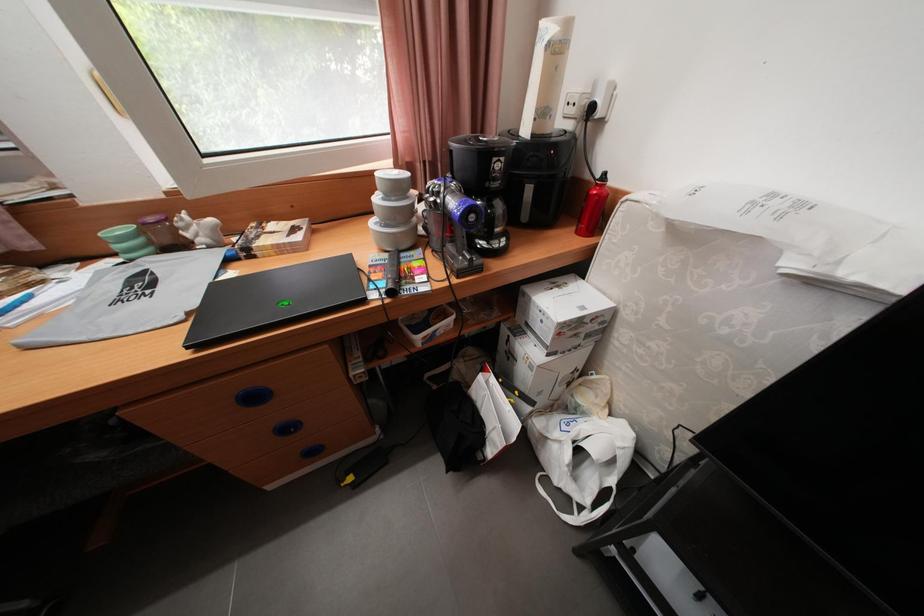
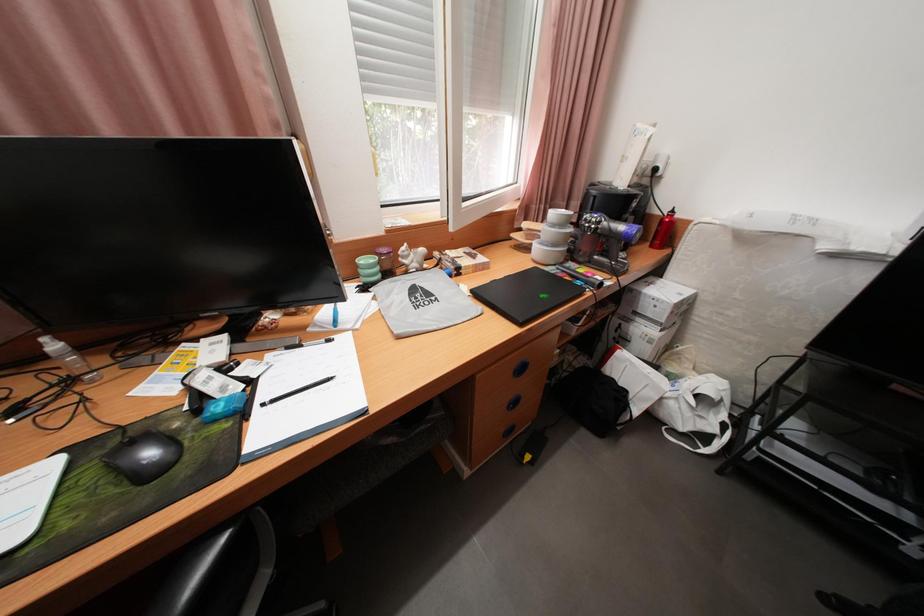
Question: How did the camera likely rotate?

Choices:
 (A) Left
 (B) Right
 (C) Up
 (D) Down

Answer: (B)